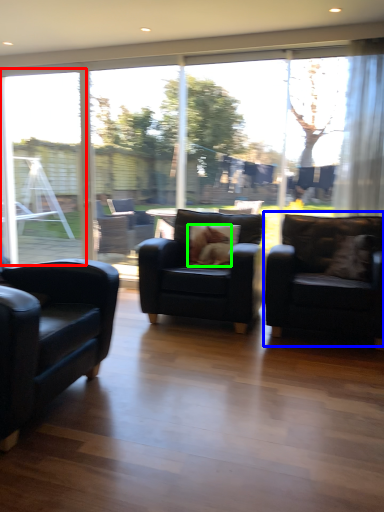
Question: Which object is the farthest from window frame (highlighted by a red box)? Choose among these: chair (highlighted by a blue box) or animal (highlighted by a green box).

Choices:
 (A) chair
 (B) animal

Answer: (A)